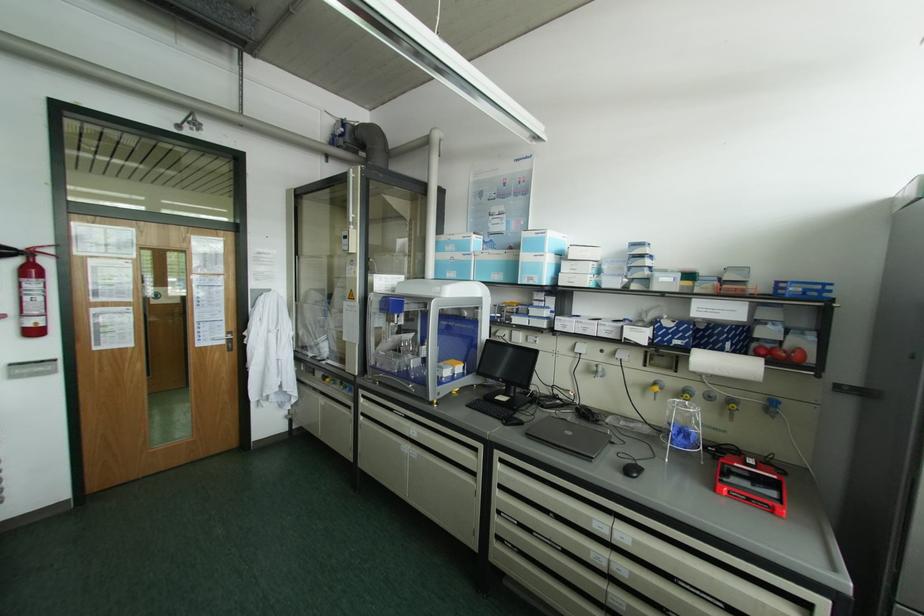
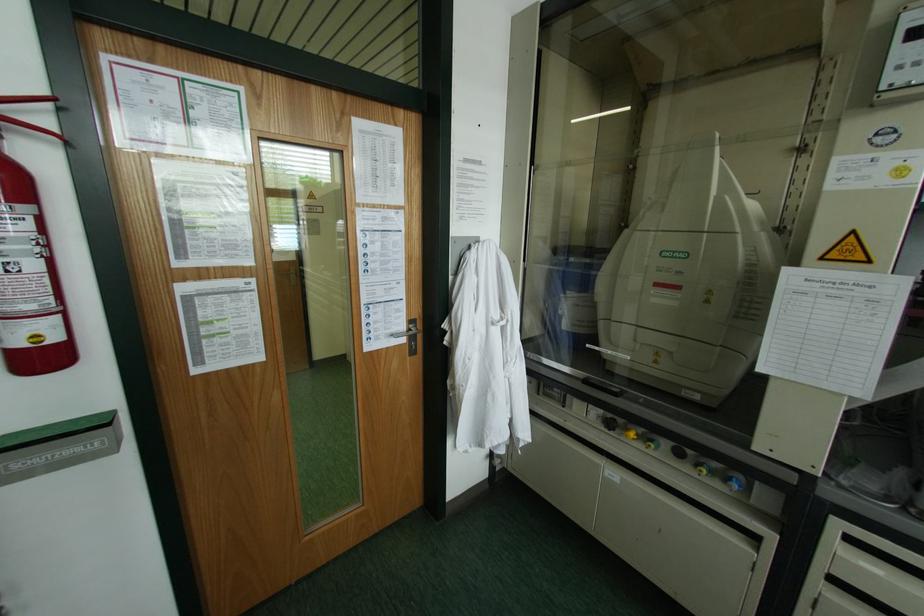
What movement of the cameraman would produce the second image?

The movement direction of the cameraman is left, forward.